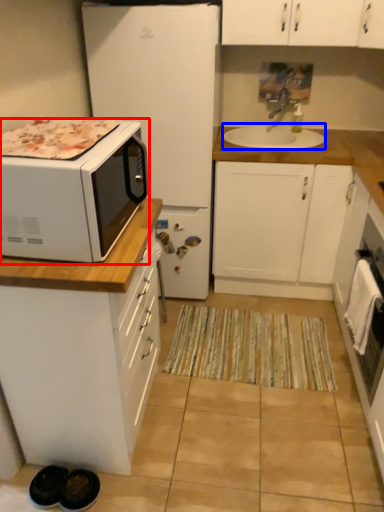
Question: Which point is further to the camera, microwave oven (highlighted by a red box) or sink (highlighted by a blue box)?

Choices:
 (A) microwave oven
 (B) sink

Answer: (B)